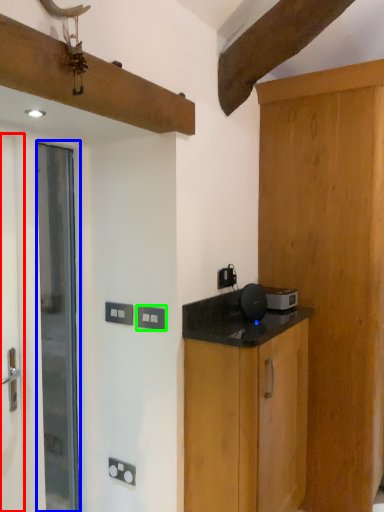
Question: Which object is positioned closest to screen door (highlighted by a red box)? Select from door (highlighted by a blue box) and electric outlet (highlighted by a green box).

Choices:
 (A) door
 (B) electric outlet

Answer: (A)